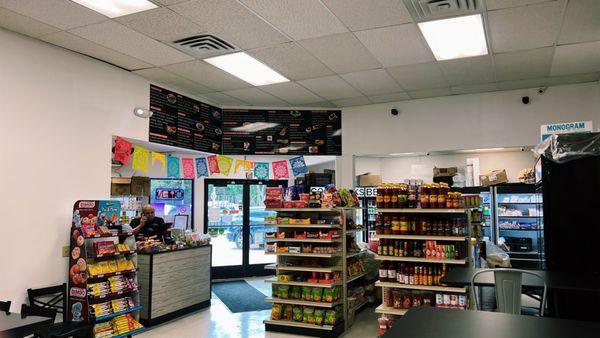
Where is `glass`? This screenshot has height=338, width=600. glass is located at coordinates (229, 235), (261, 245), (184, 185).